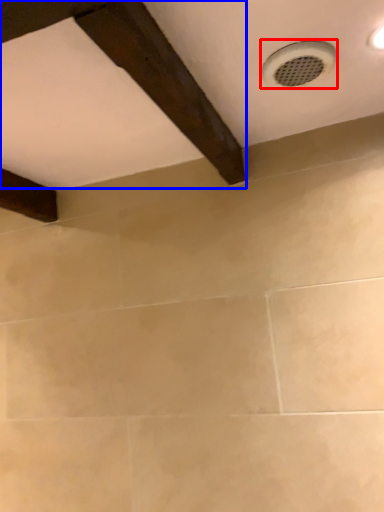
Question: Which point is closer to the camera, plumbing fixture (highlighted by a red box) or exhaust hood (highlighted by a blue box)?

Choices:
 (A) plumbing fixture
 (B) exhaust hood

Answer: (B)